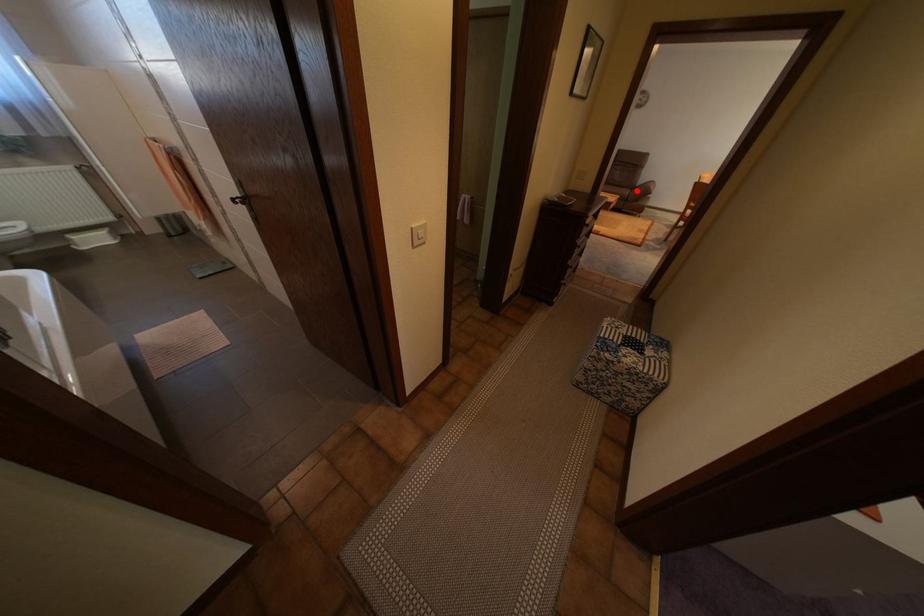
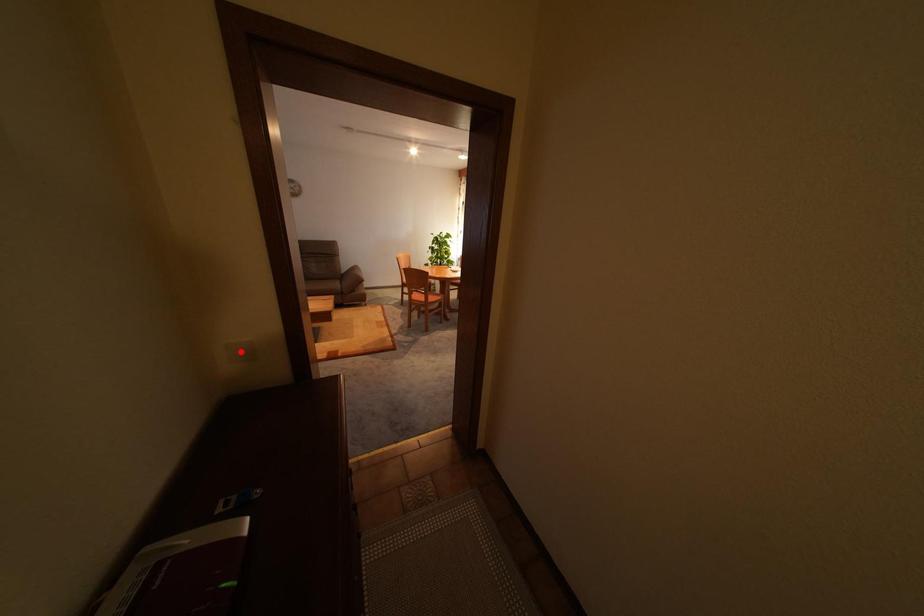
I am providing you with two images of the same scene from different viewpoints. A red point is marked on the first image and another point is marked on the second image. Does the point marked in image1 correspond to the same location as the one in image2?

No